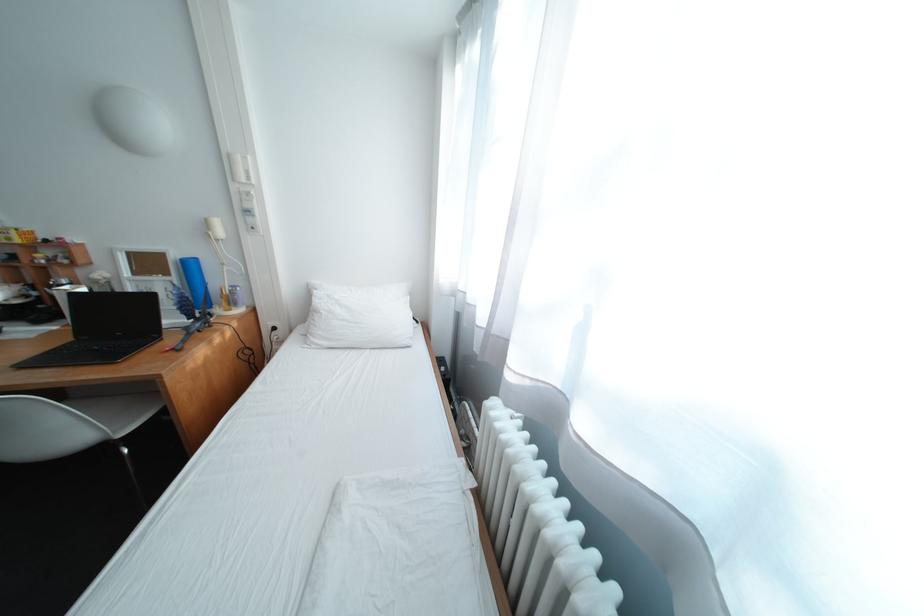
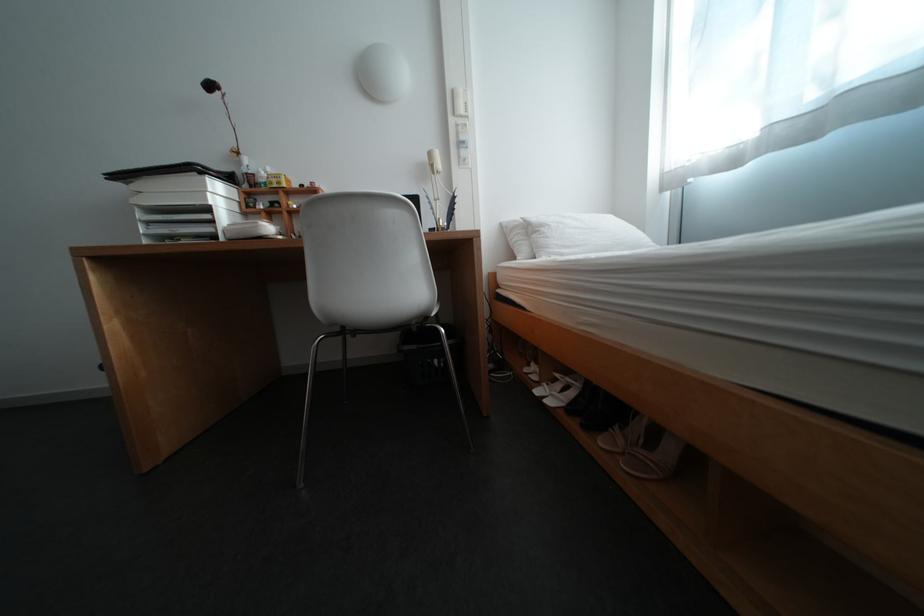
Question: I am providing you with two images of the same scene from different viewpoints. Please identify which objects are invisible in image2.

Choices:
 (A) black heeled shoe
 (B) white pillow
 (C) wall switch panel
 (D) none of these

Answer: (D)